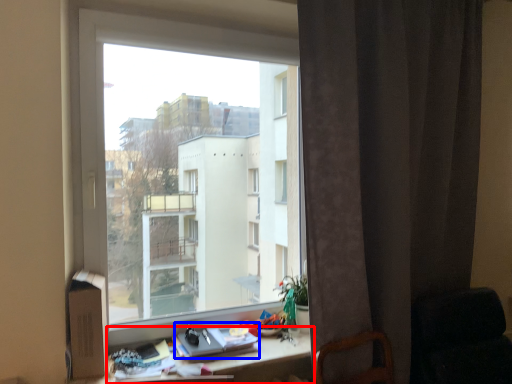
Question: Which of the following is the closest to the observer, desk (highlighted by a red box) or book (highlighted by a blue box)?

Choices:
 (A) desk
 (B) book

Answer: (A)